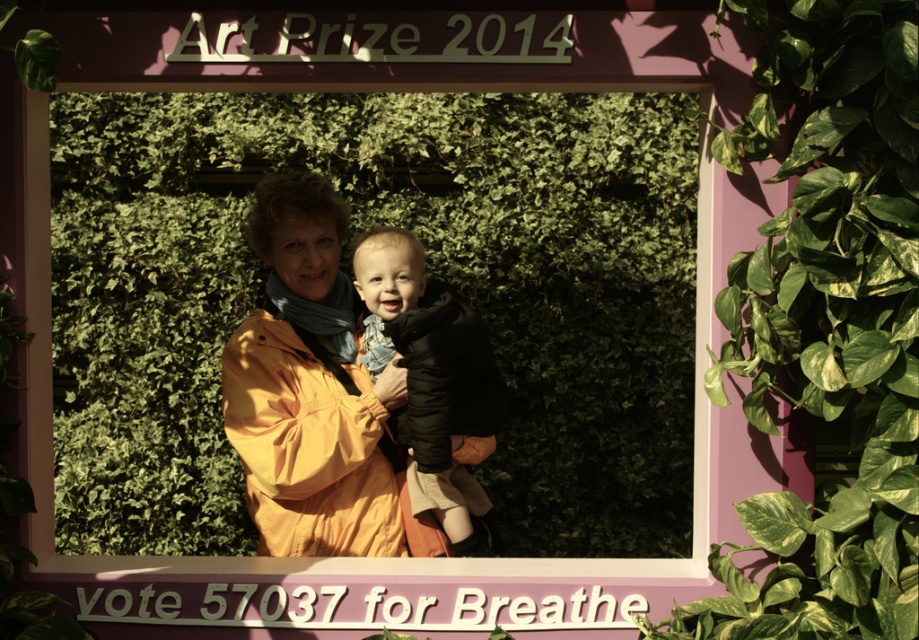
Does green leafy plant at center come behind green leafy plant at right?

Yes, it is.

Where is `green leafy plant at center`? green leafy plant at center is located at coordinates (429, 272).

This screenshot has height=640, width=919. Identify the location of green leafy plant at center. (429, 272).

Which is behind, point (161, 406) or point (430, 404)?

The point (161, 406) is more distant.

Can you confirm if green leafy plant at center is bigger than soft black puffer jacket at center?

Correct, green leafy plant at center is larger in size than soft black puffer jacket at center.

Between point (88, 362) and point (473, 522), which one is positioned behind?

Positioned behind is point (88, 362).

This screenshot has width=919, height=640. What are the coordinates of `green leafy plant at center` in the screenshot? It's located at (429, 272).

Between green leafy plant at right and soft black puffer jacket at center, which one is positioned higher?

green leafy plant at right is higher up.

This screenshot has height=640, width=919. Describe the element at coordinates (827, 324) in the screenshot. I see `green leafy plant at right` at that location.

Is point (778, 273) closer to camera compared to point (388, 288)?

Yes.

Locate an element on the screen. This screenshot has width=919, height=640. green leafy plant at right is located at coordinates 827,324.